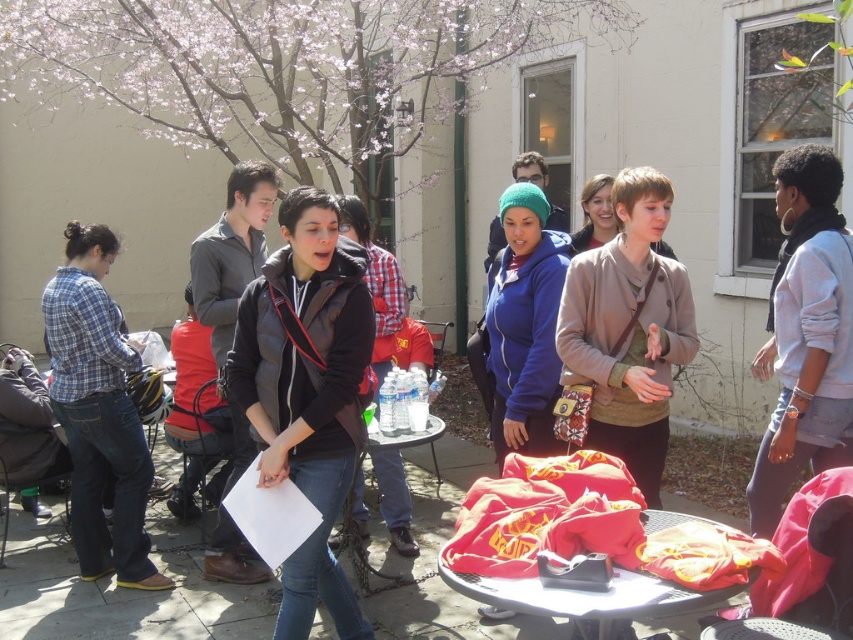
You are organizing a small event and need to arrange chairs between the black matte vest at center and the plaid cotton shirt at left. If each chair requires 0.5 meters of space, how many chairs can you place between them?

The distance between the black matte vest at center and the plaid cotton shirt at left is 1.45 meters. Each chair needs 0.5 meters, so dividing 1.45 by 0.5 gives approximately 2.9 chairs. Since you can only place whole chairs, you can fit 2 chairs between them.

You are standing in the courtyard and see the matte brown jacket at center and the light blue denim jacket at upper right. Which jacket is positioned to the left when viewed from your perspective?

The matte brown jacket at center is positioned to the left of the light blue denim jacket at upper right, so from your perspective, the matte brown jacket at center is on the left side.